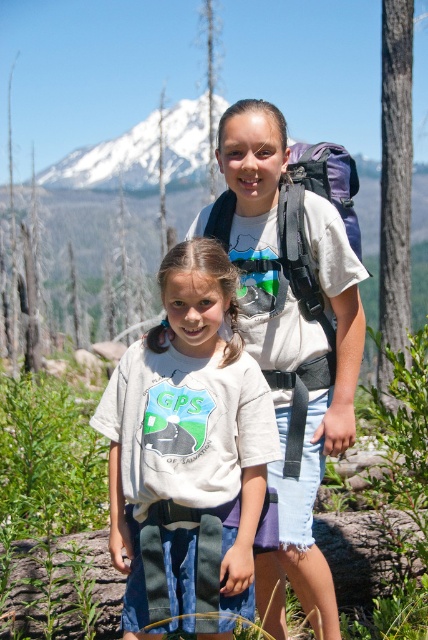
You are a hiker trying to decide whether to wear the white cotton shirt at center or carry the white matte backpack at center first. Which item takes up more space horizontally?

The white matte backpack at center has a greater width than the white cotton shirt at center, so it takes up more horizontal space.

From the picture: You are navigating a hiking trail and see the white cotton shirt at center. Based on its position, can you estimate whether it is closer to the mountain or the burnt trees in the background?

The white cotton shirt at center is located at point (187, 452), which places it closer to the mountain than the burnt trees in the background.